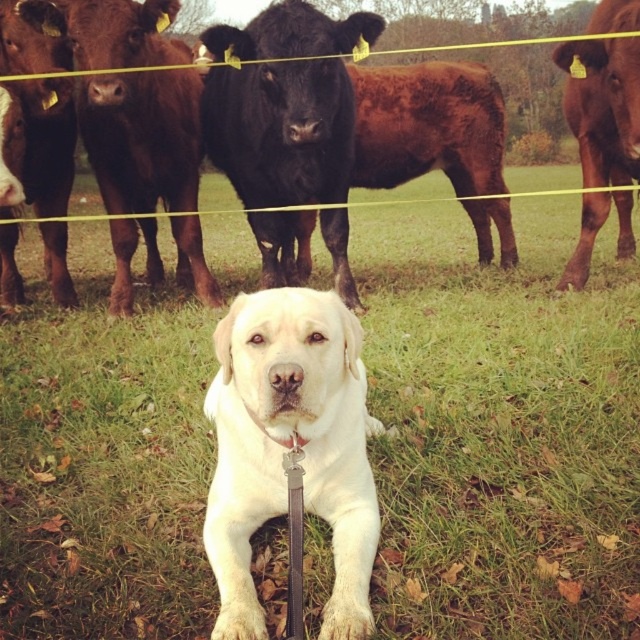
Based on the photo, where is the green grass at center located in the image?

The green grass at center is located at point (500,428).

The scene shows a white Labrador Retriever sitting on the green grass at center and a brown glossy bull at right. Which object is taller in the image?

The green grass at center is taller than the brown glossy bull at right according to the description.